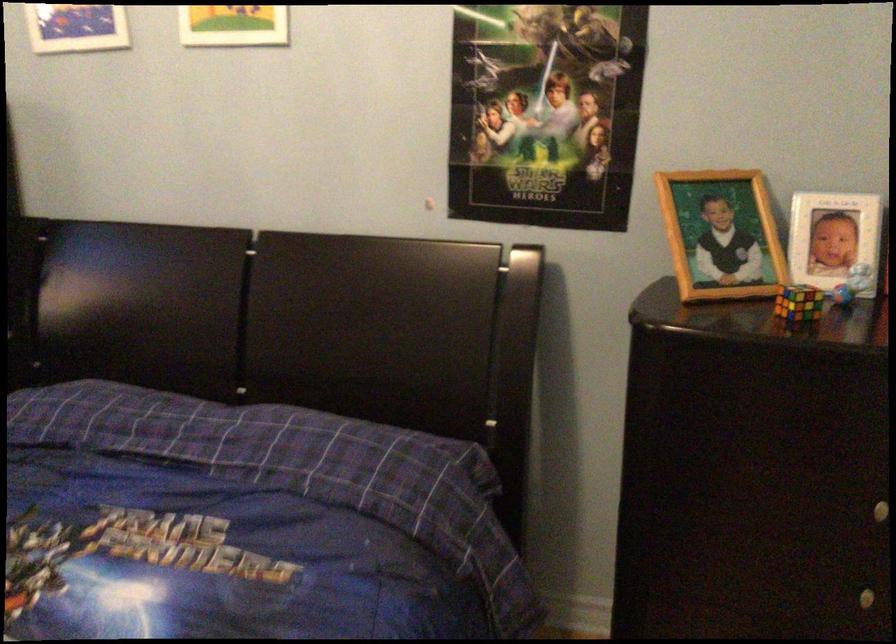
Find the location of a particular element. small blue toy is located at coordinates (851, 283).